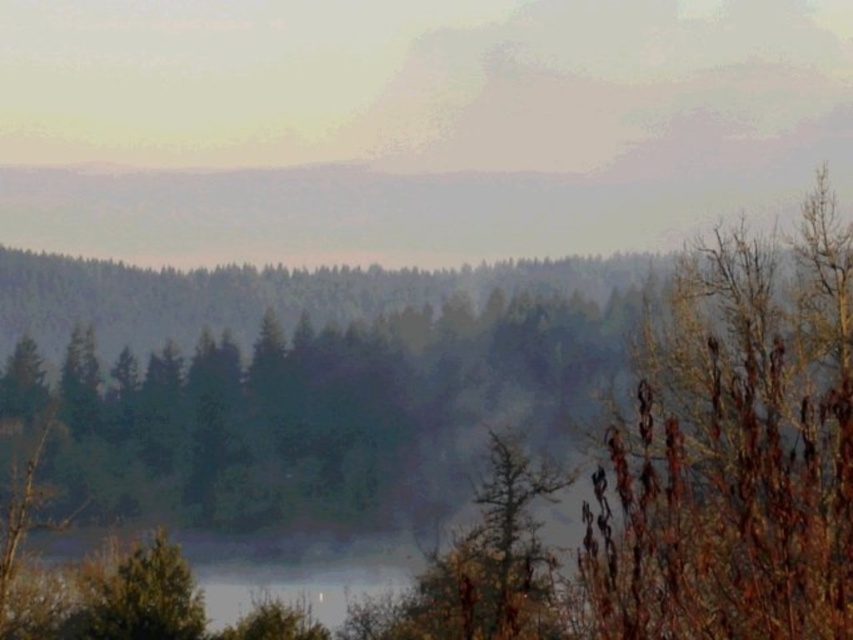
You are a GUI agent. You are given a task and a screenshot of the screen. Output one action in this format:
    pyautogui.click(x=<x>, y=<y>)
    Task: Click on the foggy mist at upper center
    Image resolution: width=853 pixels, height=640 pixels.
    Given the screenshot: What is the action you would take?
    pyautogui.click(x=408, y=124)

Is foggy mist at upper center taller than green matte tree at lower left?

Yes.

Who is more distant from viewer, [810,52] or [187,593]?

Positioned behind is point [810,52].

Where is `foggy mist at upper center`? The width and height of the screenshot is (853, 640). foggy mist at upper center is located at coordinates (408, 124).

Between point (703, 445) and point (96, 602), which one is positioned in front?

Point (703, 445) is in front.

This screenshot has width=853, height=640. Identify the location of brown dry branches at right. (735, 454).

Locate an element on the screen. This screenshot has width=853, height=640. brown dry branches at right is located at coordinates (735, 454).

Between foggy mist at upper center and brown dry branches at right, which one appears on the left side from the viewer's perspective?

Positioned to the left is foggy mist at upper center.

Who is more distant from viewer, (x=213, y=234) or (x=741, y=637)?

The point (x=213, y=234) is more distant.

Where is `foggy mist at upper center`? The image size is (853, 640). foggy mist at upper center is located at coordinates (408, 124).